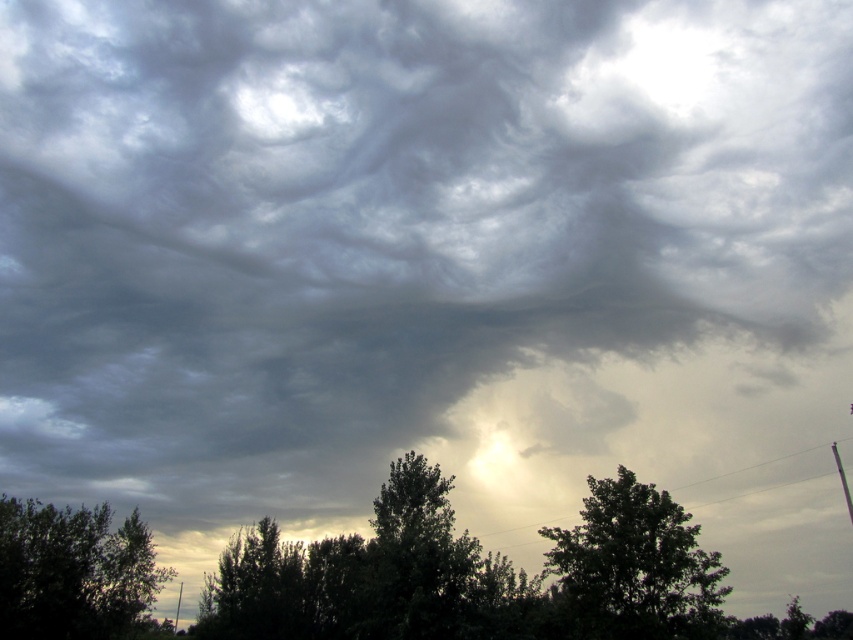
You are an ornithologist observing birds in the forest. You notice two trees in the scene. Which tree is taller, the green leafy tree at upper center or the dark green leafy tree at lower left?

The dark green leafy tree at lower left is taller than the green leafy tree at upper center.

You are standing in a field looking up at the sky scene described. There is a dark green leafy tree at lower left. Where is the dark green leafy tree positioned relative to the horizon?

The dark green leafy tree at lower left is positioned at point 0.894 on the horizontal axis and 0.087 on the vertical axis, which places it near the lower left corner of the scene, just above the horizon line.

Based on the coordinates provided, where is the green leafy tree at upper center located in the image?

The green leafy tree at upper center is located at the 2D coordinates point (634, 566).